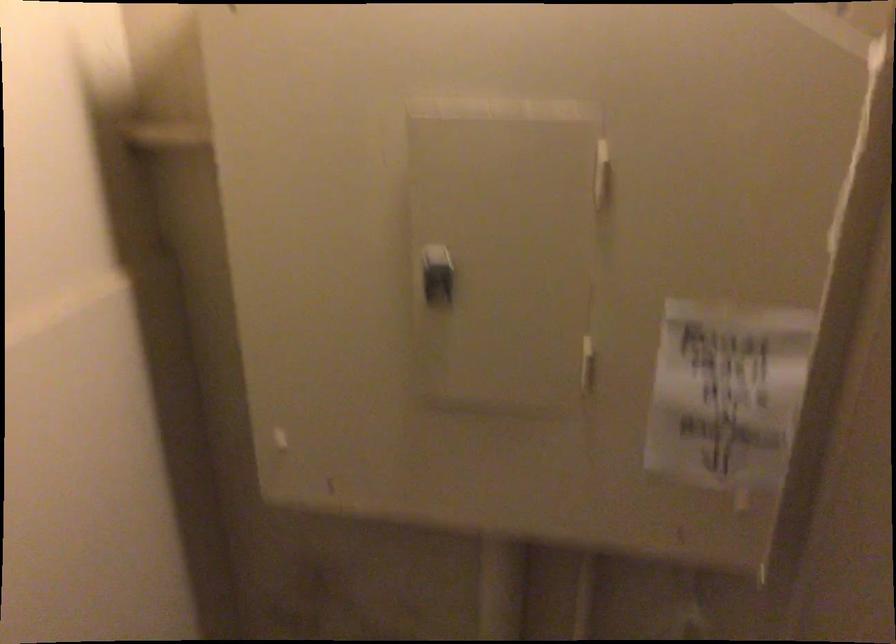
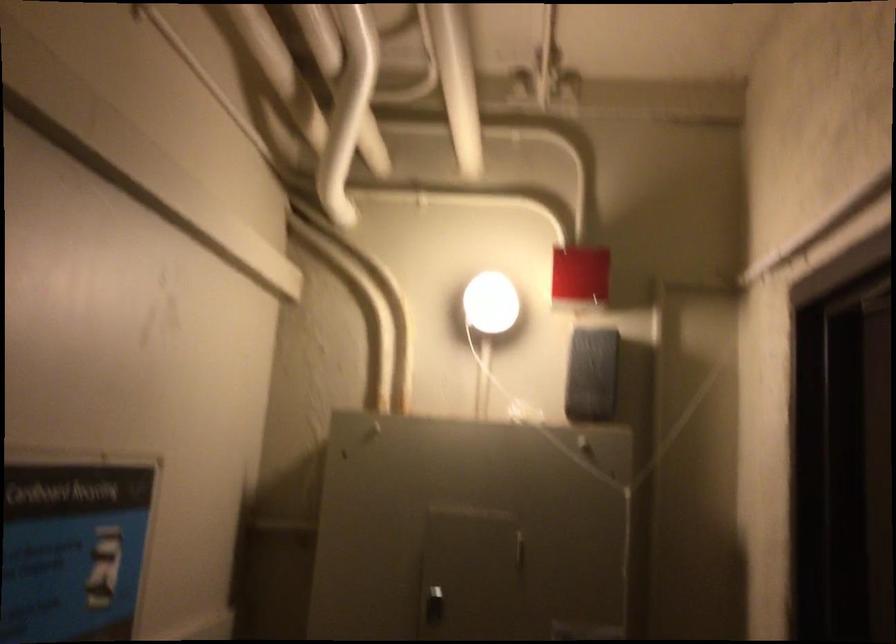
The point at (442,247) is marked in the first image. Where is the corresponding point in the second image?

(448, 578)